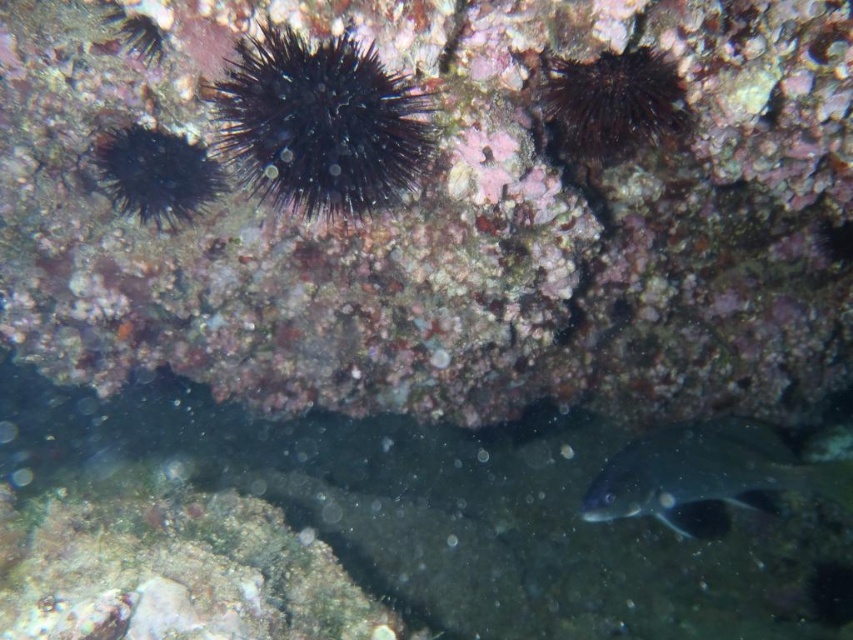
Question: Does silvery metallic fish at lower right appear on the right side of dark spiny sea urchin at upper right?

Choices:
 (A) yes
 (B) no

Answer: (A)

Question: Which of the following is the farthest from the observer?

Choices:
 (A) (637, 122)
 (B) (308, 184)

Answer: (A)

Question: Which point is farther to the camera?

Choices:
 (A) (663, 493)
 (B) (215, 115)
 (C) (122, 163)

Answer: (A)

Question: Which point is farther to the camera?

Choices:
 (A) (108, 166)
 (B) (602, 150)

Answer: (A)

Question: Can you confirm if black spiny at center is thinner than dark spiny sea urchin at upper right?

Choices:
 (A) no
 (B) yes

Answer: (A)

Question: Can you confirm if black spiny at center is positioned above black spiny at left?

Choices:
 (A) no
 (B) yes

Answer: (A)